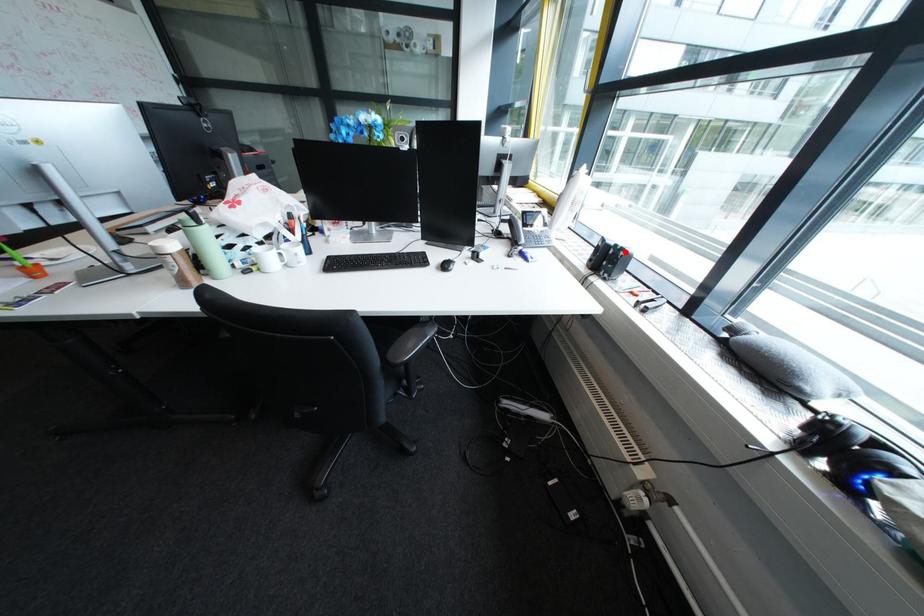
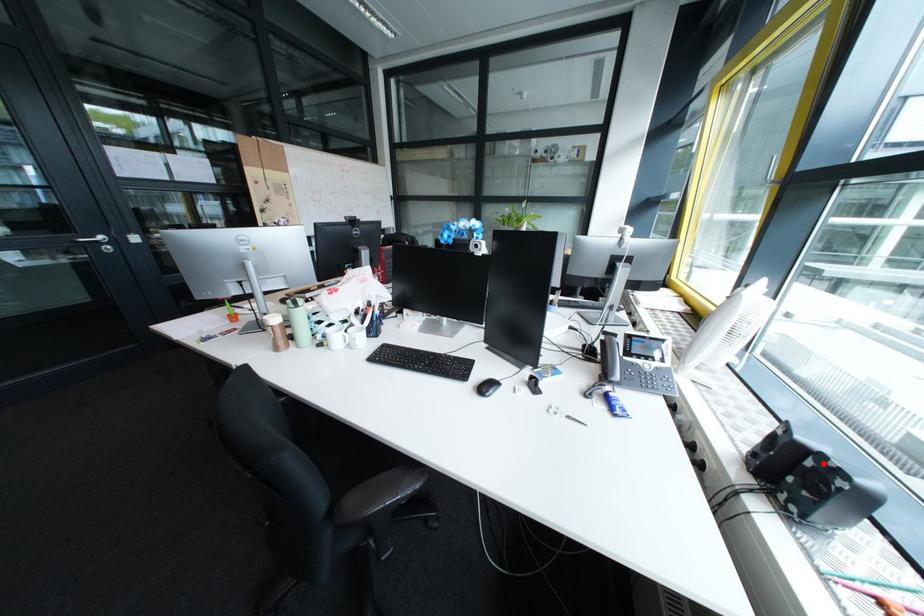
I am providing you with two images of the same scene from different viewpoints. A red point is marked on the first image and another point is marked on the second image. Does the point marked in image1 correspond to the same location as the one in image2?

Yes